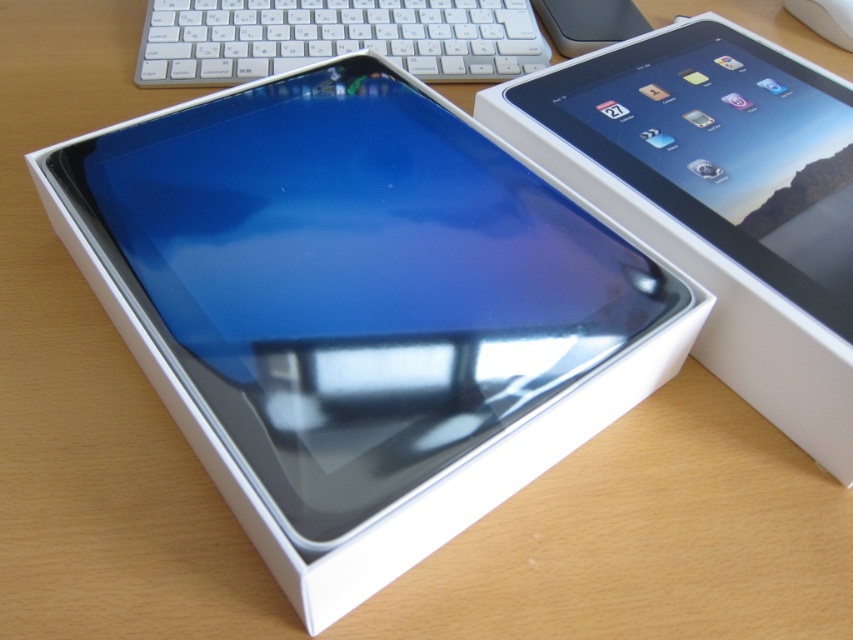
Does satin black tablet at center have a lesser width compared to white plastic mouse at upper right?

No, satin black tablet at center is not thinner than white plastic mouse at upper right.

Based on the photo, which is more to the right, satin black tablet at center or white plastic mouse at upper right?

From the viewer's perspective, white plastic mouse at upper right appears more on the right side.

Where is `satin black tablet at center`? The width and height of the screenshot is (853, 640). satin black tablet at center is located at coordinates (354, 285).

Is satin black tablet at center taller than satin black tablet at upper right?

Incorrect, satin black tablet at center's height is not larger of satin black tablet at upper right's.

This screenshot has height=640, width=853. What do you see at coordinates (354, 285) in the screenshot?
I see `satin black tablet at center` at bounding box center [354, 285].

Locate an element on the screen. The height and width of the screenshot is (640, 853). satin black tablet at center is located at coordinates (354, 285).

Can you confirm if satin black tablet at upper right is shorter than white plastic keyboard at upper center?

No, satin black tablet at upper right is not shorter than white plastic keyboard at upper center.

From the picture: Does satin black tablet at upper right have a smaller size compared to white plastic keyboard at upper center?

No.

Describe the element at coordinates (718, 198) in the screenshot. Image resolution: width=853 pixels, height=640 pixels. I see `satin black tablet at upper right` at that location.

Where is `satin black tablet at upper right`? The image size is (853, 640). satin black tablet at upper right is located at coordinates (718, 198).